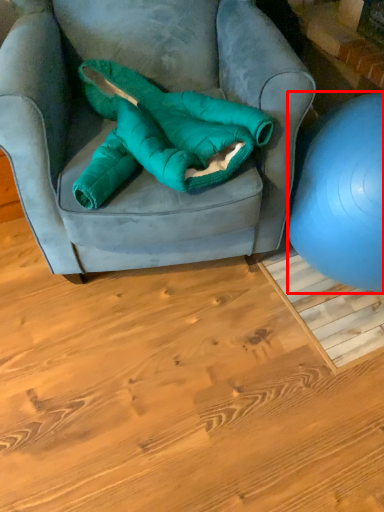
Question: From the image's perspective, where is ball (annotated by the red box) located relative to bean bag chair?

Choices:
 (A) below
 (B) above

Answer: (A)